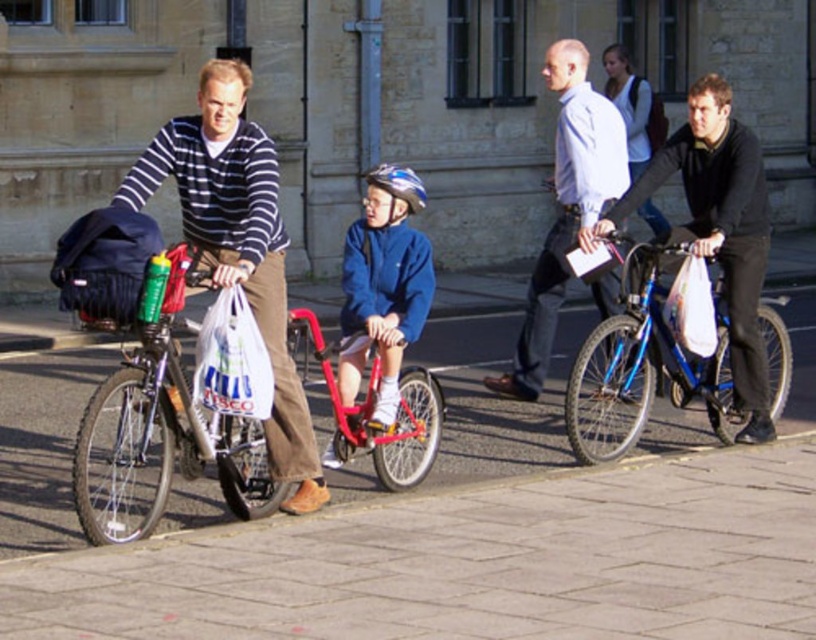
Question: Estimate the real-world distances between objects in this image. Which object is farther from the striped sweater at left?

Choices:
 (A) white shirt at center
 (B) metallic red bicycle at center
 (C) white plastic bag at center

Answer: (A)

Question: Can you confirm if shiny metallic bicycle at left is wider than blue metallic bicycle at right?

Choices:
 (A) yes
 (B) no

Answer: (B)

Question: Can you confirm if white shirt at center is smaller than white plastic bag at center?

Choices:
 (A) yes
 (B) no

Answer: (B)

Question: Does striped sweater at left have a larger size compared to white plastic bag at center?

Choices:
 (A) no
 (B) yes

Answer: (B)

Question: Which point appears farthest from the camera in this image?

Choices:
 (A) (255, 314)
 (B) (78, 365)
 (C) (662, 291)
 (D) (154, 396)

Answer: (B)

Question: Which point is closer to the camera?

Choices:
 (A) (47, 371)
 (B) (264, 266)
 (C) (574, 163)
 (D) (630, 308)

Answer: (B)